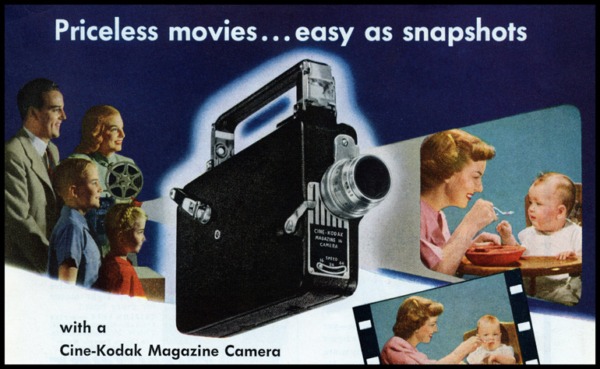
Where is `bowl`? bowl is located at coordinates (485, 255).